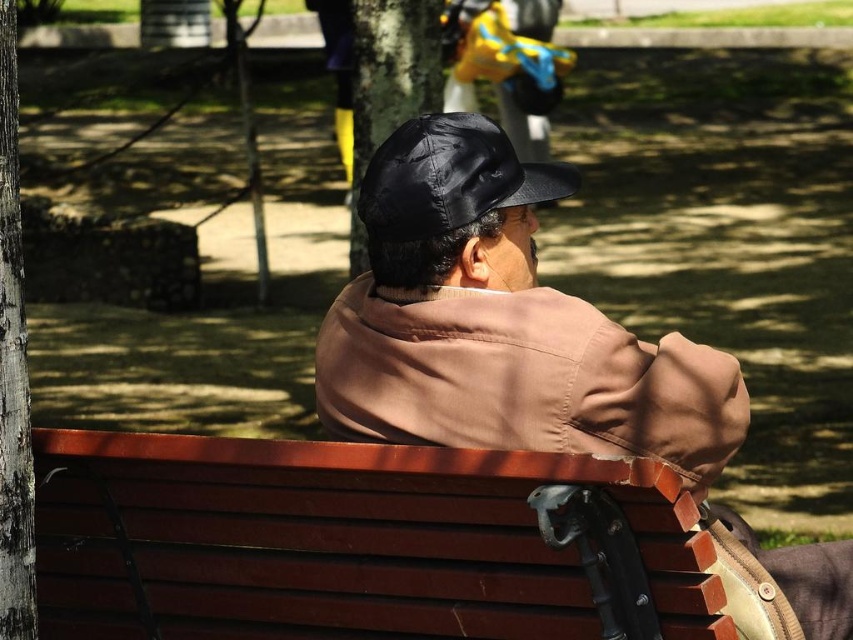
You are taking a photo of the park scene and want to focus on both the point at [6,410] and the point at [379,56]. Which point should you adjust your focus to first to ensure both are in sharp detail?

Since point [6,410] is closer to the camera than point [379,56], you should focus on the closer point first to maximize depth of field and ensure both points are in focus.

From the picture: You are a photographer standing in the park and want to capture a photo that includes both the gray textured bark at left and the black matte tree at upper center. Which object will appear larger in your photo?

The gray textured bark at left will appear larger in the photo because it is closer to the viewer than the black matte tree at upper center.